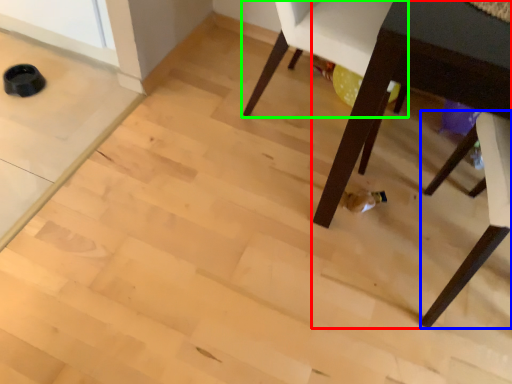
Question: Estimate the real-world distances between objects in this image. Which object is closer to table (highlighted by a red box), chair (highlighted by a blue box) or chair (highlighted by a green box)?

Choices:
 (A) chair
 (B) chair

Answer: (A)